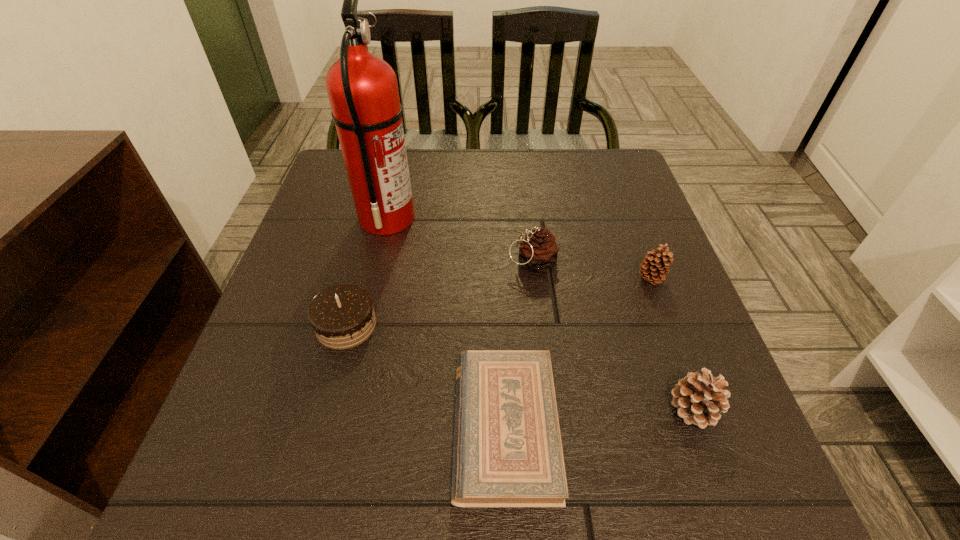
In the image, there is a desktop. Identify the location of free region at the near edge. Image resolution: width=960 pixels, height=540 pixels. (459, 512).

In the image, there is a desktop. Identify the location of free region at the left edge. The image size is (960, 540). (303, 233).

You are a GUI agent. You are given a task and a screenshot of the screen. Output one action in this format:
    pyautogui.click(x=<x>, y=<y>)
    Task: Click on the vacant region at the right edge of the desktop
    This screenshot has height=540, width=960.
    Given the screenshot: What is the action you would take?
    pyautogui.click(x=687, y=337)

Identify the location of vacant area at the near left corner of the desktop. This screenshot has width=960, height=540. (284, 495).

This screenshot has height=540, width=960. In order to click on vacant space at the far right corner of the desktop in this screenshot , I will do `click(633, 191)`.

This screenshot has width=960, height=540. In order to click on vacant space at the near right corner in this screenshot , I will do [766, 479].

This screenshot has height=540, width=960. I want to click on vacant space in between the tallest object and the nearest pinecone, so click(540, 313).

Where is `empty space that is in between the chocolate cake and the Bible`? Image resolution: width=960 pixels, height=540 pixels. empty space that is in between the chocolate cake and the Bible is located at coordinates (425, 376).

At what (x,y) coordinates should I click in order to perform the action: click on vacant area that lies between the leftmost pinecone and the nearest pinecone. Please return your answer as a coordinate pair (x, y). This screenshot has height=540, width=960. Looking at the image, I should click on (612, 335).

Locate an element on the screen. The image size is (960, 540). vacant area between the nearest pinecone and the shortest object is located at coordinates (599, 417).